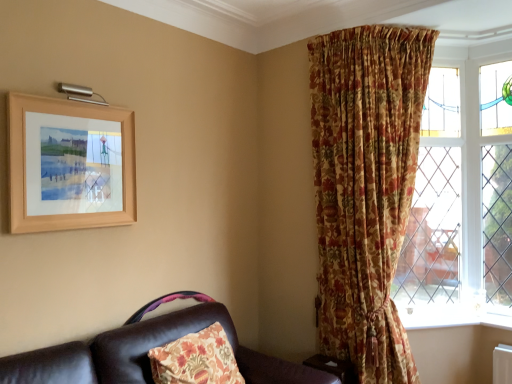
Question: From a real-world perspective, is floral fabric curtain at upper right located higher than leather couch at lower left?

Choices:
 (A) no
 (B) yes

Answer: (B)

Question: From a real-world perspective, is floral fabric curtain at upper right positioned under leather couch at lower left based on gravity?

Choices:
 (A) no
 (B) yes

Answer: (A)

Question: Is floral fabric curtain at upper right wider than leather couch at lower left?

Choices:
 (A) no
 (B) yes

Answer: (A)

Question: Does floral fabric curtain at upper right appear on the right side of leather couch at lower left?

Choices:
 (A) yes
 (B) no

Answer: (A)

Question: Considering the relative sizes of floral fabric curtain at upper right and leather couch at lower left in the image provided, is floral fabric curtain at upper right shorter than leather couch at lower left?

Choices:
 (A) yes
 (B) no

Answer: (B)

Question: From their relative heights in the image, would you say leather couch at lower left is taller or shorter than wooden frame at upper left?

Choices:
 (A) tall
 (B) short

Answer: (B)

Question: In terms of size, does leather couch at lower left appear bigger or smaller than wooden frame at upper left?

Choices:
 (A) big
 (B) small

Answer: (A)

Question: In the image, is leather couch at lower left positioned in front of or behind wooden frame at upper left?

Choices:
 (A) front
 (B) behind

Answer: (A)

Question: Would you say leather couch at lower left is to the left or to the right of wooden frame at upper left in the picture?

Choices:
 (A) right
 (B) left

Answer: (A)

Question: Considering the positions of leather couch at lower left and white painted wood at lower right in the image, is leather couch at lower left taller or shorter than white painted wood at lower right?

Choices:
 (A) tall
 (B) short

Answer: (A)

Question: Based on their sizes in the image, would you say leather couch at lower left is bigger or smaller than white painted wood at lower right?

Choices:
 (A) small
 (B) big

Answer: (B)

Question: Does point click(135, 322) appear closer or farther from the camera than point click(417, 327)?

Choices:
 (A) farther
 (B) closer

Answer: (B)

Question: Is leather couch at lower left to the left or to the right of white painted wood at lower right in the image?

Choices:
 (A) left
 (B) right

Answer: (A)

Question: Does point [451, 306] appear closer or farther from the camera than point [24, 168]?

Choices:
 (A) closer
 (B) farther

Answer: (B)

Question: From a real-world perspective, relative to wooden frame at upper left, is white painted wood at lower right vertically above or below?

Choices:
 (A) below
 (B) above

Answer: (A)